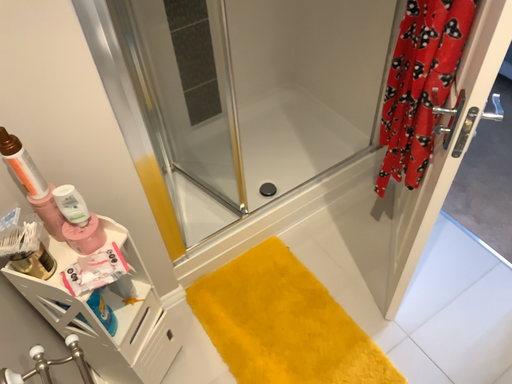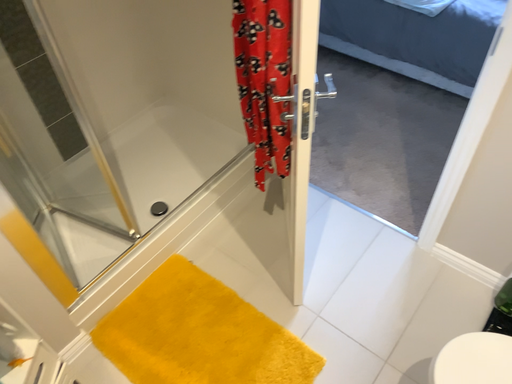
Question: How did the camera likely rotate when shooting the video?

Choices:
 (A) rotated left
 (B) rotated right

Answer: (B)